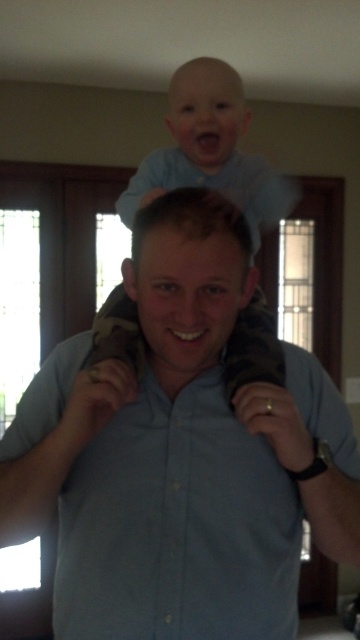
Looking at this image, you are a photographer setting up a shoot in the room described. You need to ensure that the blue cotton shirt at center and the light blue fabric at upper center are both visible in the frame. Given their widths, which object should you prioritize framing closer to the camera to avoid cropping?

The blue cotton shirt at center has a greater width than the light blue fabric at upper center, so you should prioritize framing the blue cotton shirt at center closer to the camera to accommodate its larger size and ensure both are visible without cropping.

You are a photographer setting up for a family photo. You notice the blue cotton shirt at center and the light blue shirt at upper center in the scene. Which shirt is closer to the camera?

The blue cotton shirt at center is closer to the camera because it is in front of the light blue shirt at upper center.

You are a photographer setting up for a family portrait. You need to ensure that both the blue cotton shirt at center and the light blue shirt at upper center are in focus. Given that your camera has a depth of field that can cover objects within 15 inches of each other, will both shirts be in focus?

The blue cotton shirt at center is 14.73 inches away from the light blue shirt at upper center. Since the distance between them is within the 15 inches depth of field, both shirts will be in focus.